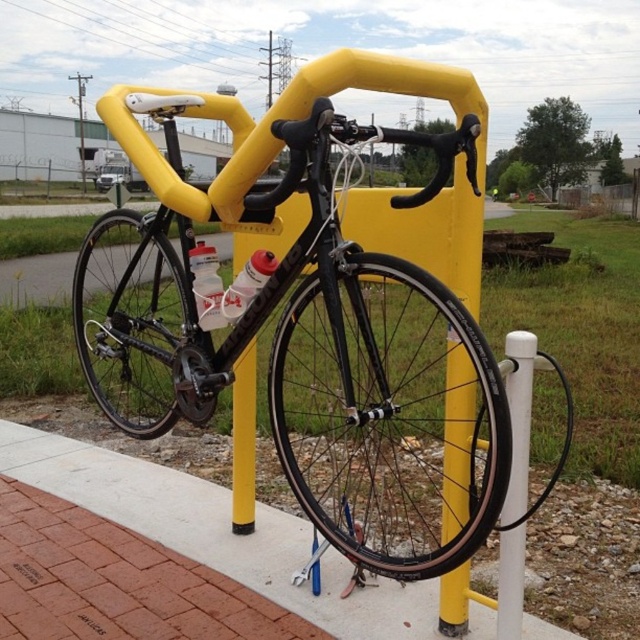
You are standing at the edge of the paved area and want to walk to the white pole with a coiled cable. Which direction should you move relative to the matte black bicycle at center and the concrete at lower left?

Since the matte black bicycle at center is to the right of the concrete at lower left, you should move towards the left side of the matte black bicycle at center to reach the white pole with a coiled cable.

You are a delivery person who needs to check if your bike is taller than the ground. Looking at the scene, can you confirm if the matte black bicycle at center is taller than the concrete at lower left?

The matte black bicycle at center has a greater height compared to concrete at lower left, so yes, the bike is taller than the concrete at lower left.